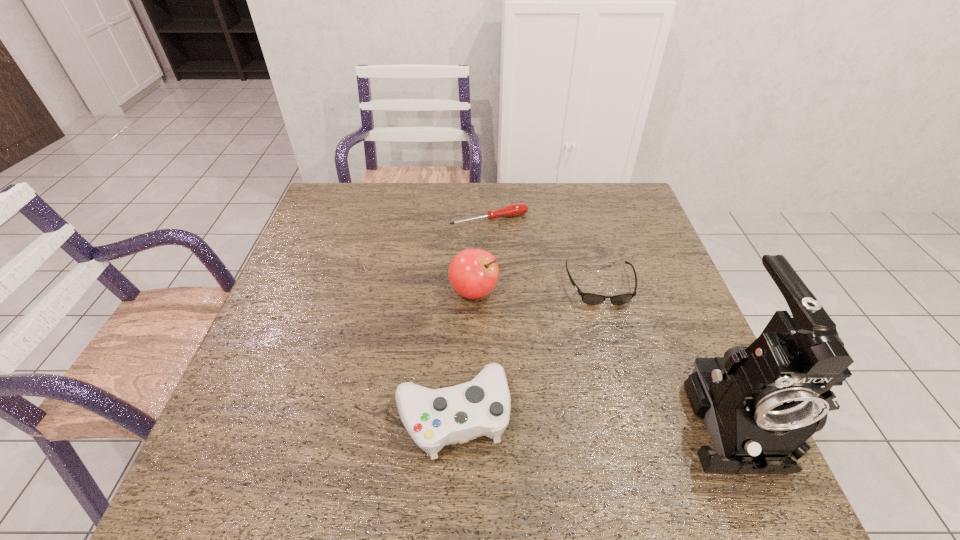
What are the coordinates of `free space between the tallest object and the shortest object` in the screenshot? It's located at (611, 317).

In order to click on unoccupied position between the tallest object and the sunglasses in this screenshot , I will do `click(666, 350)`.

You are a GUI agent. You are given a task and a screenshot of the screen. Output one action in this format:
    pyautogui.click(x=<x>, y=<y>)
    Task: Click on the free point between the control and the fourth shortest object
    This screenshot has height=540, width=960.
    Given the screenshot: What is the action you would take?
    pyautogui.click(x=463, y=353)

Identify the location of empty space between the third shortest object and the second tallest object. This screenshot has width=960, height=540. (x=463, y=353).

Locate an element on the screen. vacant area that lies between the third tallest object and the apple is located at coordinates (463, 353).

The height and width of the screenshot is (540, 960). In order to click on vacant point located between the third tallest object and the tallest object in this screenshot , I will do `click(592, 414)`.

Identify the location of free space between the tallest object and the fourth shortest object. (603, 353).

This screenshot has height=540, width=960. I want to click on unoccupied position between the sunglasses and the fourth shortest object, so click(537, 288).

This screenshot has width=960, height=540. What are the coordinates of `vacant space that's between the shortest object and the tallest object` in the screenshot? It's located at (611, 317).

Image resolution: width=960 pixels, height=540 pixels. Find the location of `object that is the third closest to the screwdriver`. object that is the third closest to the screwdriver is located at coordinates (434, 418).